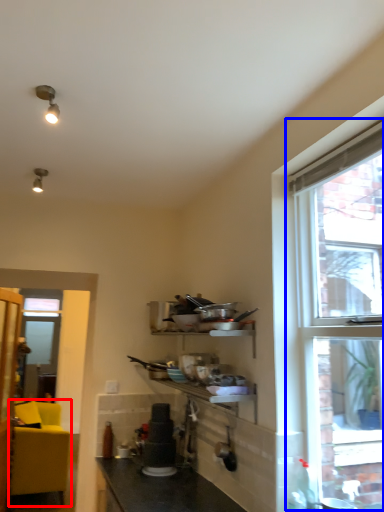
Question: Which object appears farthest to the camera in this image, studio couch (highlighted by a red box) or window (highlighted by a blue box)?

Choices:
 (A) studio couch
 (B) window

Answer: (A)